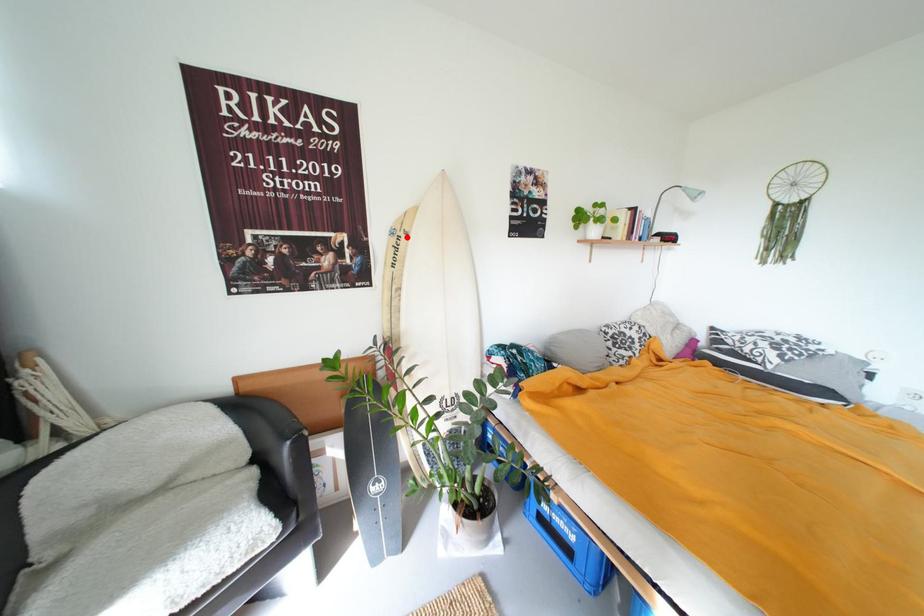
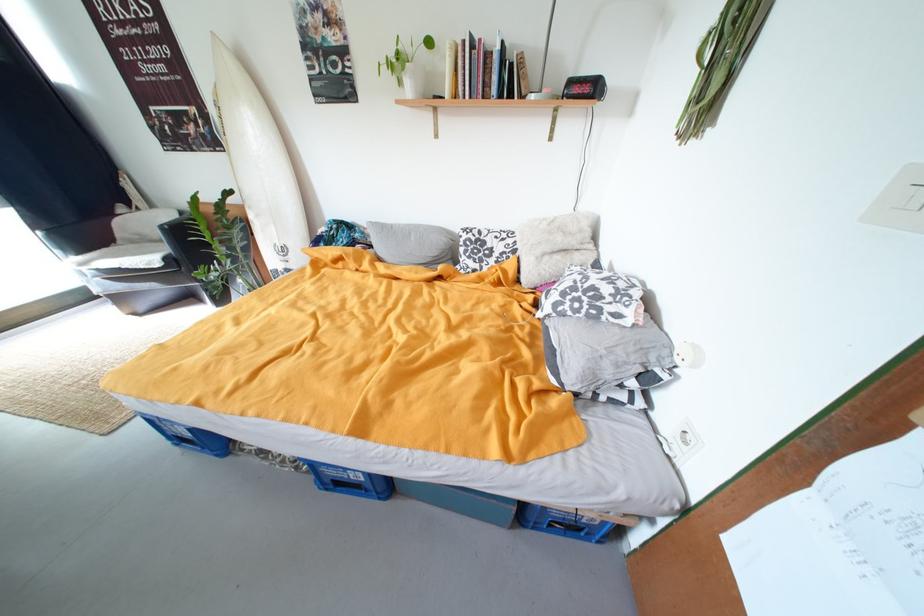
Question: I am providing you with two images of the same scene from different viewpoints. A red point is marked on the first image. Is the red point's position out of view in image 2?

Choices:
 (A) Yes
 (B) No

Answer: (B)